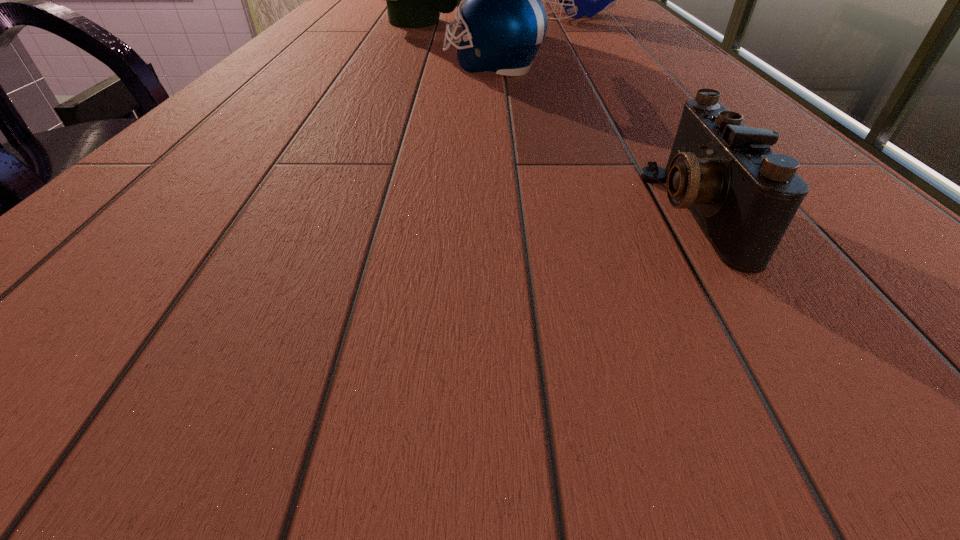
The width and height of the screenshot is (960, 540). What are the coordinates of `free spot located on the face guard of the rightmost football helmet` in the screenshot? It's located at (479, 17).

Locate an element on the screen. This screenshot has height=540, width=960. free location located at the front of the third farthest object with the faceguard is located at coordinates (303, 66).

Find the location of a particular element. vacant space located at the front of the third farthest object with the faceguard is located at coordinates (375, 66).

Identify the location of free space located 0.070m at the front of the third farthest object with the faceguard. (409, 66).

The height and width of the screenshot is (540, 960). In order to click on vacant space located 0.400m on the front-facing side of the camera in this screenshot , I will do `click(317, 212)`.

The image size is (960, 540). I want to click on vacant space located 0.390m on the front-facing side of the camera, so (324, 212).

I want to click on blank space located 0.100m on the front-facing side of the camera, so click(571, 212).

The width and height of the screenshot is (960, 540). I want to click on object positioned at the left edge, so click(414, 0).

Where is `football helmet present at the right edge`? The height and width of the screenshot is (540, 960). football helmet present at the right edge is located at coordinates click(578, 0).

Find the location of a particular element. The width and height of the screenshot is (960, 540). camera that is at the right edge is located at coordinates (744, 196).